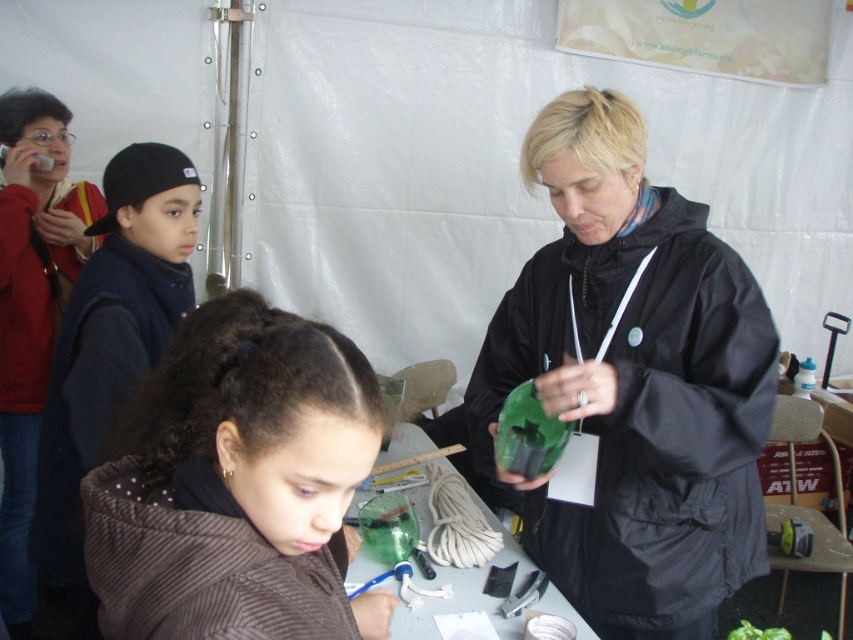
Question: Can you confirm if brown textured jacket at lower left is positioned to the right of translucent plastic bottle at center?

Choices:
 (A) yes
 (B) no

Answer: (B)

Question: Can you confirm if green matte mask at center is bigger than brown textured jacket at lower left?

Choices:
 (A) yes
 (B) no

Answer: (A)

Question: Which object appears closest to the camera in this image?

Choices:
 (A) black fleece jacket at left
 (B) green matte mask at center

Answer: (B)

Question: Where is green matte mask at center located in relation to brown textured jacket at lower left in the image?

Choices:
 (A) above
 (B) below

Answer: (A)

Question: Among these objects, which one is farthest from the camera?

Choices:
 (A) green matte mask at center
 (B) translucent plastic bottle at center

Answer: (B)

Question: Among these points, which one is farthest from the camera?

Choices:
 (A) (587, 525)
 (B) (73, 618)
 (C) (575, 614)
 (D) (125, 525)

Answer: (B)